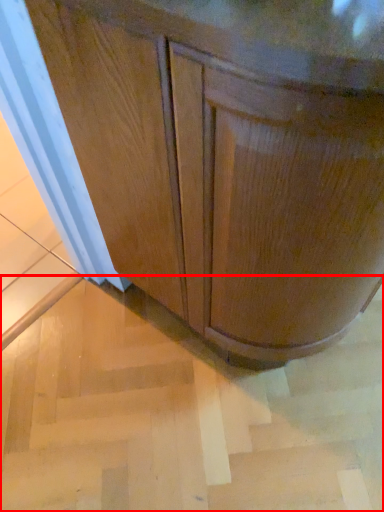
Question: Considering the relative positions of stair (annotated by the red box) and cabinetry in the image provided, where is stair (annotated by the red box) located with respect to the staircase?

Choices:
 (A) right
 (B) left

Answer: (B)